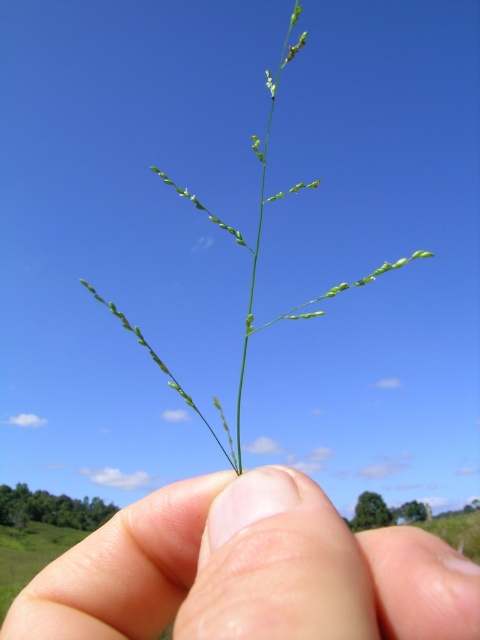
You are holding a plant in your hand and want to place it in a pot. The pot has a small hole at point (249, 572). Will the plant stem fit through the hole?

The point (249, 572) has smooth skin at center, so the plant stem cannot fit through the hole there.

You are holding a green leafy plant at center in your hand and notice there is smooth skin at center touching it. Which object has a smaller width according to the description?

The smooth skin at center has a smaller width than the green leafy plant at center according to the description.